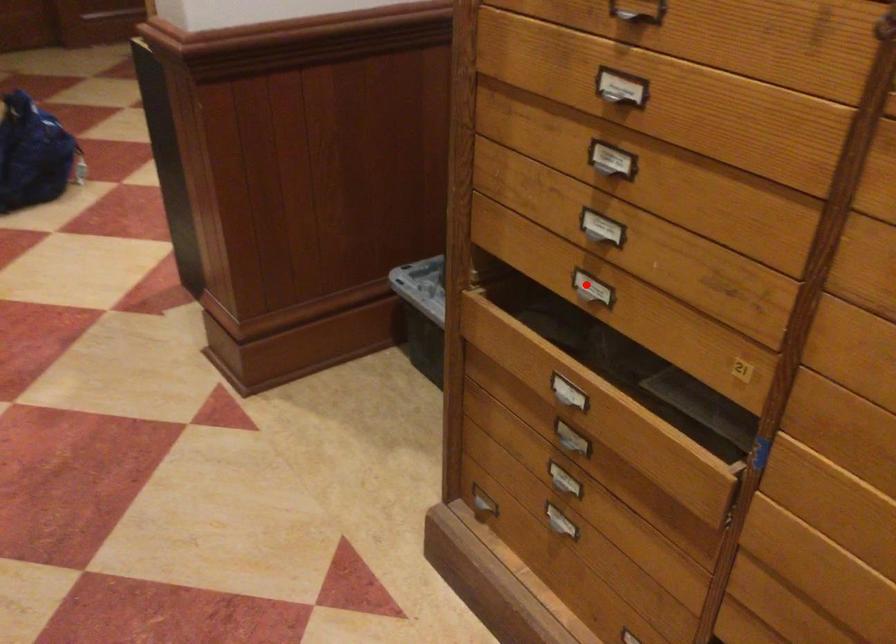
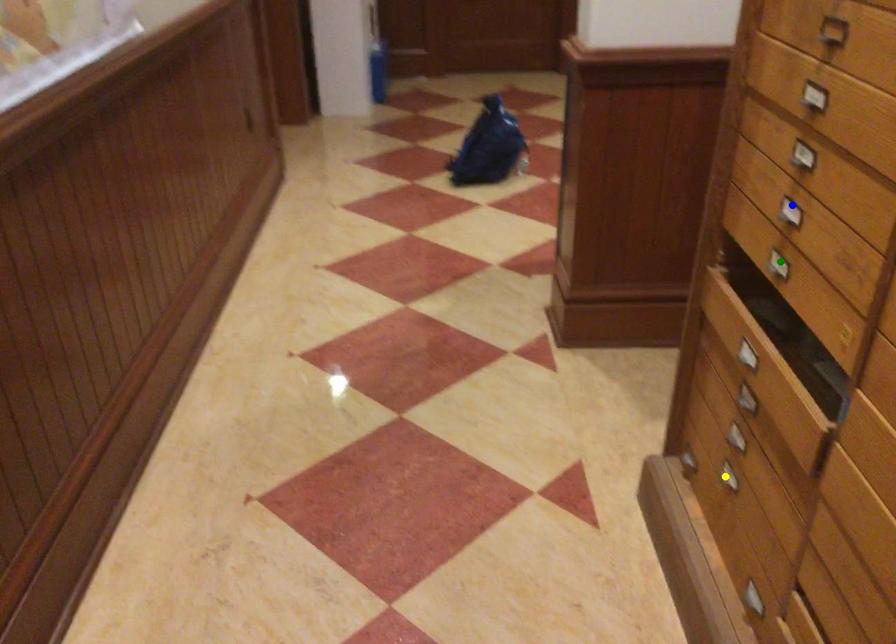
Question: I am providing you with two images of the same scene from different viewpoints. A red point is marked on the first image. You are given multiple points on the second image. Can you choose the point in image 2 that corresponds to the point in image 1?

Choices:
 (A) yellow point
 (B) blue point
 (C) green point

Answer: (C)